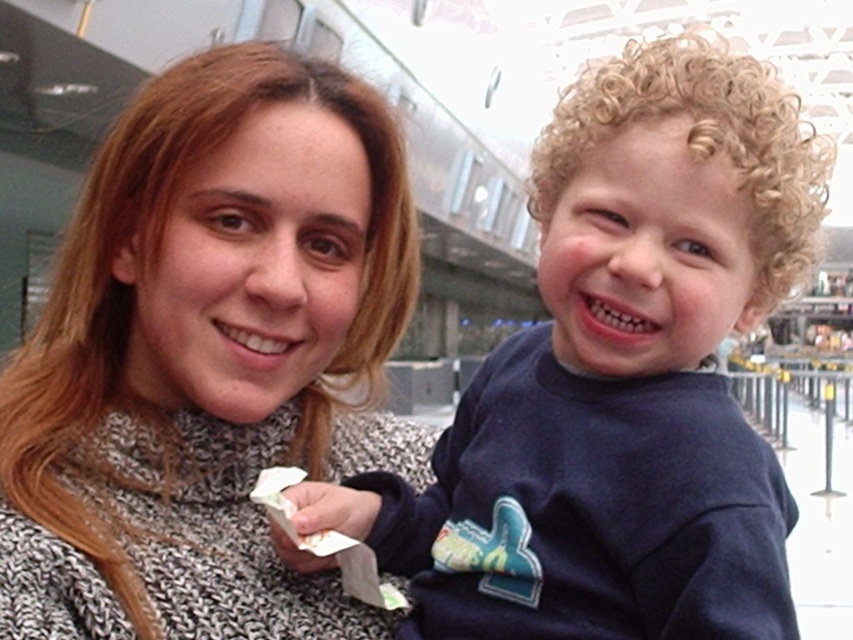
Between knitted sweater at center and dark blue sweatshirt at right, which one is positioned lower?

Positioned lower is dark blue sweatshirt at right.

Which is more to the right, knitted sweater at center or dark blue sweatshirt at right?

Positioned to the right is dark blue sweatshirt at right.

Identify the location of knitted sweater at center. (207, 356).